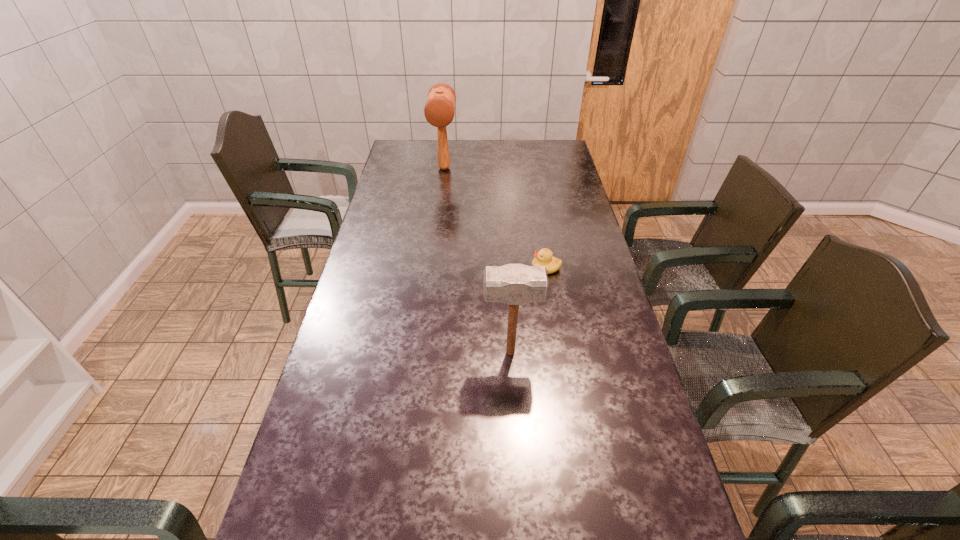
Where is `unoccupied area between the shorter mallet and the farther mallet`? This screenshot has width=960, height=540. unoccupied area between the shorter mallet and the farther mallet is located at coordinates (477, 260).

This screenshot has width=960, height=540. Identify the location of vacant space that's between the second farthest object and the nearest object. (528, 310).

Image resolution: width=960 pixels, height=540 pixels. In order to click on vacant space that's between the duckling and the farthest object in this screenshot , I will do `click(495, 218)`.

The image size is (960, 540). Find the location of `unoccupied area between the left mallet and the second object from right to left`. unoccupied area between the left mallet and the second object from right to left is located at coordinates (477, 260).

The image size is (960, 540). What are the coordinates of `blank region between the nearer mallet and the duckling` in the screenshot? It's located at (528, 310).

Locate an element on the screen. The height and width of the screenshot is (540, 960). free point between the second farthest object and the farther mallet is located at coordinates (495, 218).

Identify the location of free space between the rightmost object and the leftmost object. This screenshot has width=960, height=540. (495, 218).

Locate an element on the screen. The height and width of the screenshot is (540, 960). free area in between the tallest object and the second farthest object is located at coordinates (495, 218).

Point out which object is positioned as the nearest to the leftmost object. Please provide its 2D coordinates. Your answer should be formatted as a tuple, i.e. [(x, y)], where the tuple contains the x and y coordinates of a point satisfying the conditions above.

[(544, 257)]

Select which object appears as the second closest to the rightmost object. Please provide its 2D coordinates. Your answer should be formatted as a tuple, i.e. [(x, y)], where the tuple contains the x and y coordinates of a point satisfying the conditions above.

[(439, 111)]